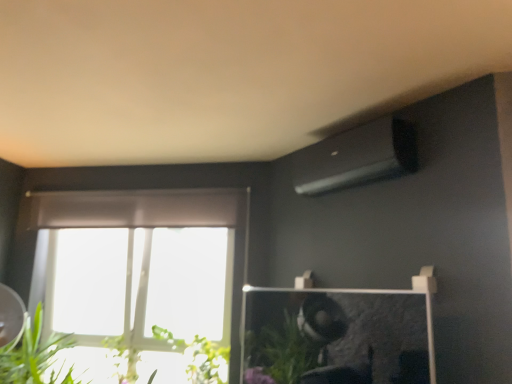
The width and height of the screenshot is (512, 384). What do you see at coordinates (36, 357) in the screenshot? I see `green leafy plant at lower left` at bounding box center [36, 357].

The width and height of the screenshot is (512, 384). What are the coordinates of `green leafy plant at lower left, placed as the 1th plant when sorted from right to left` in the screenshot? It's located at (198, 356).

Considering the positions of points (187, 349) and (16, 362), is point (187, 349) closer to camera compared to point (16, 362)?

No.

Looking at this image, is green leafy plant at lower left a part of green leafy plant at lower left, the second plant viewed from the left?

No, green leafy plant at lower left is not a part of green leafy plant at lower left, the second plant viewed from the left.

Which object is positioned more to the right, green leafy plant at lower left, the second plant viewed from the left, or green leafy plant at lower left?

From the viewer's perspective, green leafy plant at lower left, the second plant viewed from the left, appears more on the right side.

Considering the relative sizes of green leafy plant at lower left, the second plant viewed from the left, and green leafy plant at lower left in the image provided, is green leafy plant at lower left, the second plant viewed from the left, wider than green leafy plant at lower left?

No, green leafy plant at lower left, the second plant viewed from the left, is not wider than green leafy plant at lower left.

From a real-world perspective, which object rests below the other?

green leafy plant at lower left, which ranks as the first plant in left-to-right order, is physically lower.

Considering the sizes of objects green leafy plant at lower left, which is counted as the 2th plant, starting from the right, and green leafy plant at lower left, placed as the 1th plant when sorted from right to left, in the image provided, who is taller, green leafy plant at lower left, which is counted as the 2th plant, starting from the right, or green leafy plant at lower left, placed as the 1th plant when sorted from right to left,?

With more height is green leafy plant at lower left, placed as the 1th plant when sorted from right to left.

Is green leafy plant at lower left, which is counted as the 2th plant, starting from the right, smaller than green leafy plant at lower left, the second plant viewed from the left?

Indeed, green leafy plant at lower left, which is counted as the 2th plant, starting from the right, has a smaller size compared to green leafy plant at lower left, the second plant viewed from the left.

Visually, is green leafy plant at lower left, which ranks as the first plant in left-to-right order, positioned to the left or to the right of green leafy plant at lower left, placed as the 1th plant when sorted from right to left?

Based on their positions, green leafy plant at lower left, which ranks as the first plant in left-to-right order, is located to the left of green leafy plant at lower left, placed as the 1th plant when sorted from right to left.

Who is smaller, green leafy plant at lower left, which ranks as the first plant in left-to-right order, or green leafy plant at lower left?

green leafy plant at lower left, which ranks as the first plant in left-to-right order, is smaller.

Is green leafy plant at lower left, which is counted as the 2th plant, starting from the right, far from green leafy plant at lower left?

green leafy plant at lower left, which is counted as the 2th plant, starting from the right, is actually quite close to green leafy plant at lower left.

Is green leafy plant at lower left, which is counted as the 2th plant, starting from the right, to the right of green leafy plant at lower left from the viewer's perspective?

Yes.

Measure the distance between green leafy plant at lower left, which is counted as the 2th plant, starting from the right, and green leafy plant at lower left.

They are 46.73 centimeters apart.

Can you confirm if green leafy plant at lower left is shorter than green leafy plant at lower left, which ranks as the first plant in left-to-right order?

No, green leafy plant at lower left is not shorter than green leafy plant at lower left, which ranks as the first plant in left-to-right order.

Is point (52, 363) closer or farther from the camera than point (136, 367)?

Point (52, 363) is closer to the camera than point (136, 367).

Can you see green leafy plant at lower left touching green leafy plant at lower left, which ranks as the first plant in left-to-right order?

No, green leafy plant at lower left is not next to green leafy plant at lower left, which ranks as the first plant in left-to-right order.

Locate an element on the screen. The image size is (512, 384). houseplant that appears above the green leafy plant at lower left, which is counted as the 2th plant, starting from the right (from the image's perspective) is located at coordinates (36, 357).

How different are the orientations of green leafy plant at lower left and green leafy plant at lower left, placed as the 1th plant when sorted from right to left, in degrees?

The angular difference between green leafy plant at lower left and green leafy plant at lower left, placed as the 1th plant when sorted from right to left, is 5.93 degrees.

In terms of width, does green leafy plant at lower left look wider or thinner when compared to green leafy plant at lower left, the second plant viewed from the left?

In the image, green leafy plant at lower left appears to be wider than green leafy plant at lower left, the second plant viewed from the left.

Is green leafy plant at lower left next to green leafy plant at lower left, the second plant viewed from the left, and touching it?

No, green leafy plant at lower left is not next to green leafy plant at lower left, the second plant viewed from the left.

Which of these two, green leafy plant at lower left or green leafy plant at lower left, placed as the 1th plant when sorted from right to left, is smaller?

Smaller between the two is green leafy plant at lower left, placed as the 1th plant when sorted from right to left.

Considering the sizes of green leafy plant at lower left, placed as the 1th plant when sorted from right to left, and green leafy plant at lower left, which is counted as the 2th plant, starting from the right, in the image, is green leafy plant at lower left, placed as the 1th plant when sorted from right to left, bigger or smaller than green leafy plant at lower left, which is counted as the 2th plant, starting from the right,?

green leafy plant at lower left, placed as the 1th plant when sorted from right to left, is bigger than green leafy plant at lower left, which is counted as the 2th plant, starting from the right.

From a real-world perspective, is green leafy plant at lower left, the second plant viewed from the left, positioned above or below green leafy plant at lower left, which is counted as the 2th plant, starting from the right?

green leafy plant at lower left, the second plant viewed from the left, is above green leafy plant at lower left, which is counted as the 2th plant, starting from the right.

Image resolution: width=512 pixels, height=384 pixels. What are the coordinates of `plant that appears behind the green leafy plant at lower left, the second plant viewed from the left` in the screenshot? It's located at (123, 359).

Can you tell me how much green leafy plant at lower left, placed as the 1th plant when sorted from right to left, and green leafy plant at lower left, which ranks as the first plant in left-to-right order, differ in facing direction?

4.7 degrees separate the facing orientations of green leafy plant at lower left, placed as the 1th plant when sorted from right to left, and green leafy plant at lower left, which ranks as the first plant in left-to-right order.

The image size is (512, 384). Find the location of `plant that is the 1st one when counting downward from the green leafy plant at lower left (from the image's perspective)`. plant that is the 1st one when counting downward from the green leafy plant at lower left (from the image's perspective) is located at coordinates click(198, 356).

Where is `plant above the green leafy plant at lower left, which is counted as the 2th plant, starting from the right (from a real-world perspective)`? plant above the green leafy plant at lower left, which is counted as the 2th plant, starting from the right (from a real-world perspective) is located at coordinates (198, 356).

Based on their spatial positions, is green leafy plant at lower left, which is counted as the 2th plant, starting from the right, or green leafy plant at lower left closer to green leafy plant at lower left, the second plant viewed from the left?

The object closer to green leafy plant at lower left, the second plant viewed from the left, is green leafy plant at lower left, which is counted as the 2th plant, starting from the right.

Based on their spatial positions, is green leafy plant at lower left, the second plant viewed from the left, or green leafy plant at lower left, which ranks as the first plant in left-to-right order, closer to green leafy plant at lower left?

green leafy plant at lower left, which ranks as the first plant in left-to-right order.

Looking at the image, which one is located closer to green leafy plant at lower left, the second plant viewed from the left, green leafy plant at lower left or green leafy plant at lower left, which ranks as the first plant in left-to-right order?

The object closer to green leafy plant at lower left, the second plant viewed from the left, is green leafy plant at lower left, which ranks as the first plant in left-to-right order.

From the image, which object appears to be nearer to green leafy plant at lower left, which ranks as the first plant in left-to-right order, green leafy plant at lower left or green leafy plant at lower left, placed as the 1th plant when sorted from right to left?

Based on the image, green leafy plant at lower left, placed as the 1th plant when sorted from right to left, appears to be nearer to green leafy plant at lower left, which ranks as the first plant in left-to-right order.

When comparing their distances from green leafy plant at lower left, which ranks as the first plant in left-to-right order, does green leafy plant at lower left, placed as the 1th plant when sorted from right to left, or green leafy plant at lower left seem further?

Among the two, green leafy plant at lower left is located further to green leafy plant at lower left, which ranks as the first plant in left-to-right order.

Looking at this image, when comparing their distances from green leafy plant at lower left, does green leafy plant at lower left, which ranks as the first plant in left-to-right order, or green leafy plant at lower left, the second plant viewed from the left, seem further?

Based on the image, green leafy plant at lower left, the second plant viewed from the left, appears to be further to green leafy plant at lower left.

You are a GUI agent. You are given a task and a screenshot of the screen. Output one action in this format:
    pyautogui.click(x=<x>, y=<y>)
    Task: Click on the plant located between green leafy plant at lower left and green leafy plant at lower left, placed as the 1th plant when sorted from right to left, in the left-right direction
    Image resolution: width=512 pixels, height=384 pixels.
    Given the screenshot: What is the action you would take?
    pyautogui.click(x=123, y=359)